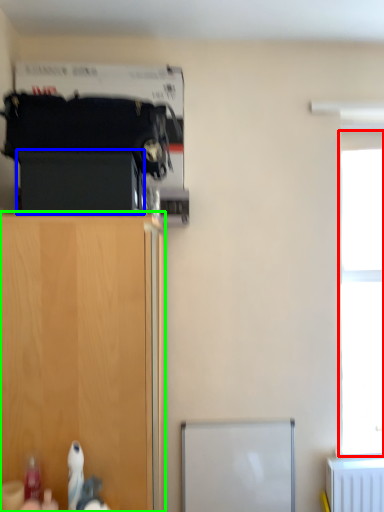
Question: Based on their relative distances, which object is nearer to window (highlighted by a red box)? Choose from cabinetry (highlighted by a blue box) and cupboard (highlighted by a green box).

Choices:
 (A) cabinetry
 (B) cupboard

Answer: (B)